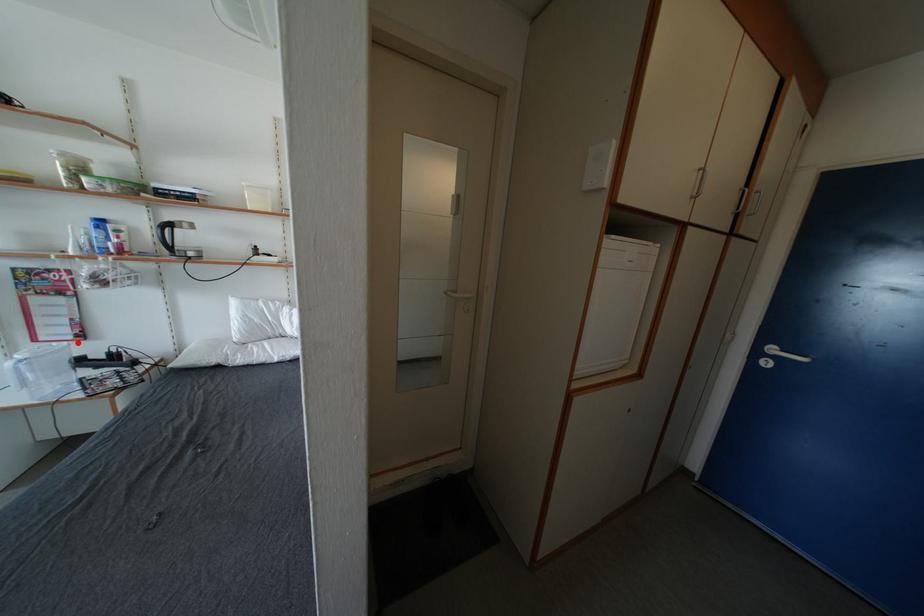
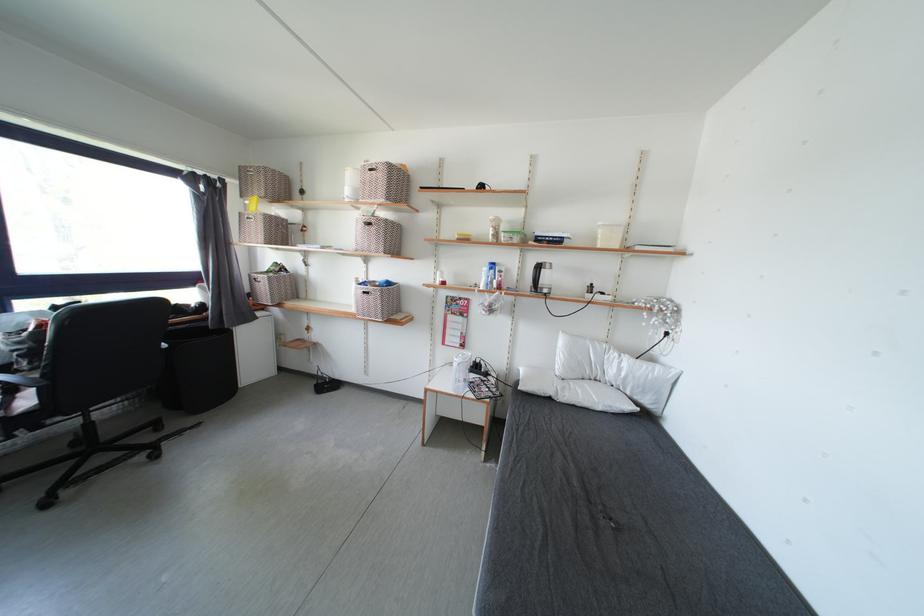
In the second image, find the point that corresponds to the highlighted location in the first image.

(465, 351)